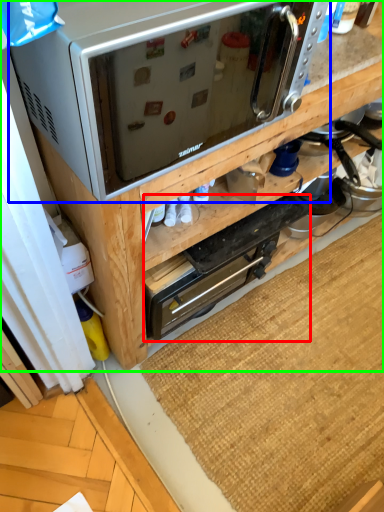
Question: Considering the real-world distances, which object is farthest from appliance (highlighted by a red box)? microwave oven (highlighted by a blue box) or cabinetry (highlighted by a green box)?

Choices:
 (A) microwave oven
 (B) cabinetry

Answer: (A)